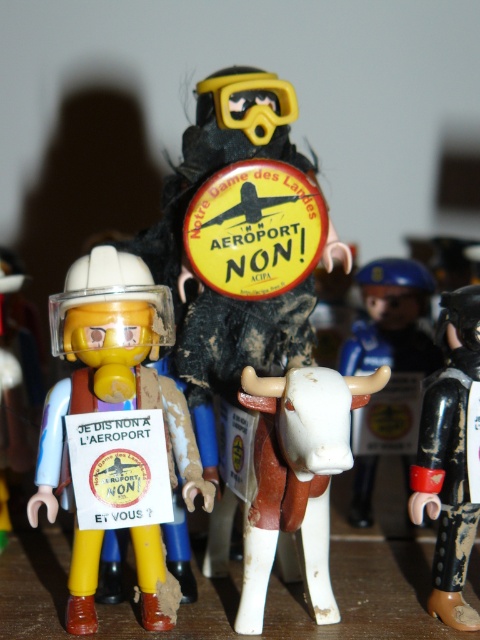
Looking at this image, you are an observer looking at the scene described. Where is the white matte cow at right located in terms of its coordinates?

The white matte cow at right is located at coordinates point (392, 317).

Based on the scene described, can the white matte cow at right fit through a gap that is just wide enough for the yellow matte goggles at upper center?

The white matte cow at right might be wider than yellow matte goggles at upper center, so it may not fit through the gap.

You are an observer looking at the scene of toy figurines. The matte black figure at center has a sign, and the white matte bull at center is positioned somewhere. From your vantage point, which object is closer to you?

The matte black figure at center is closer to you because the white matte bull at center is positioned behind it.